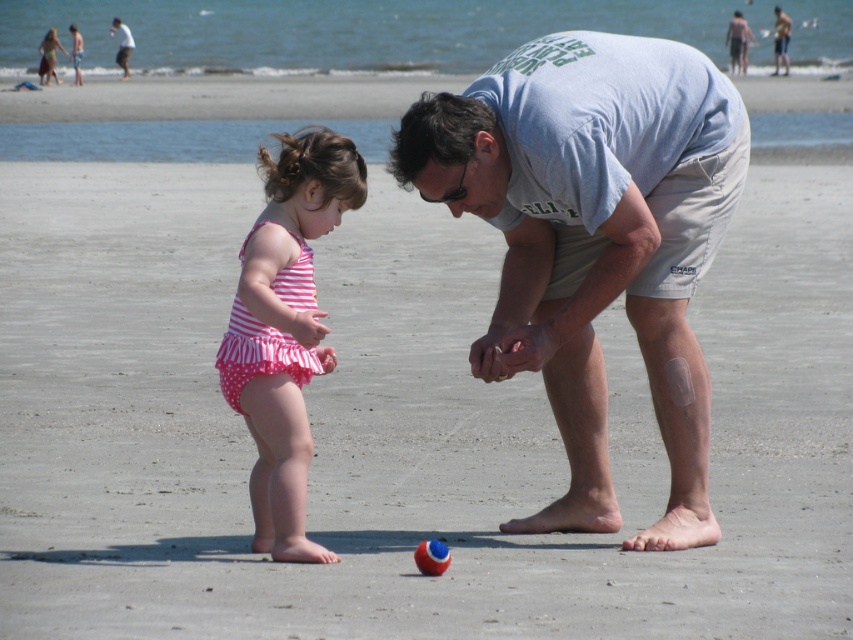
You are a photographer standing at the edge of the beach. You want to take a photo of the gray cotton shirt at center and the red glossy beach ball at center without any obstruction. Which object should you focus on first to ensure both are in the frame?

You should focus on the gray cotton shirt at center first because it is closer to you than the red glossy beach ball at center, so by focusing on it, the beach ball will naturally be in the background and still in the frame.